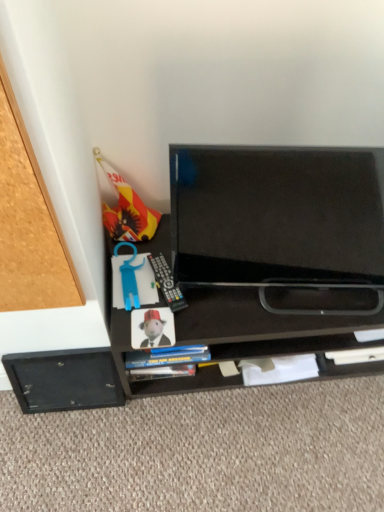
At what (x,y) coordinates should I click in order to perform the action: click on vacant space underneath black glossy tv at center (from a real-world perspective). Please return your answer as a coordinate pair (x, y). The image size is (384, 512). Looking at the image, I should click on (271, 300).